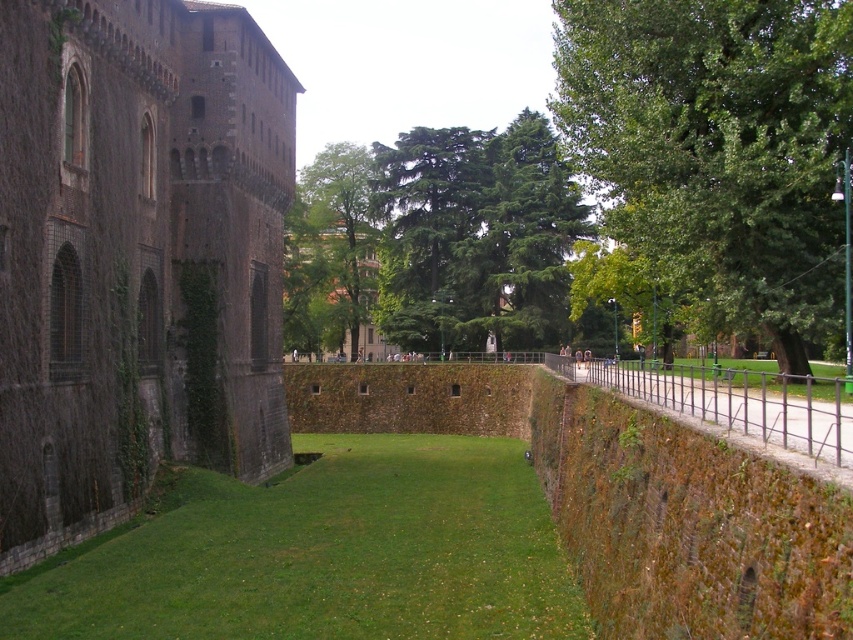
Question: Which object is the closest to the green grass at center?

Choices:
 (A) green leafy tree at right
 (B) green leafy tree at center
 (C) dark stone wall at left
 (D) green mossy stone wall at right

Answer: (D)

Question: Which object is the closest to the green grass at right?

Choices:
 (A) green mossy stone wall at right
 (B) green leafy tree at right
 (C) green leafy tree at center
 (D) dark stone wall at left

Answer: (B)

Question: Is green mossy stone wall at right in front of green grass at right?

Choices:
 (A) yes
 (B) no

Answer: (A)

Question: In this image, where is dark stone wall at left located relative to green grass at center?

Choices:
 (A) left
 (B) right

Answer: (A)

Question: Is dark stone wall at left to the right of green mossy stone wall at right from the viewer's perspective?

Choices:
 (A) no
 (B) yes

Answer: (A)

Question: Which of these objects is positioned farthest from the green leafy tree at right?

Choices:
 (A) green grass at right
 (B) green mossy stone wall at right
 (C) green leafy tree at center

Answer: (C)